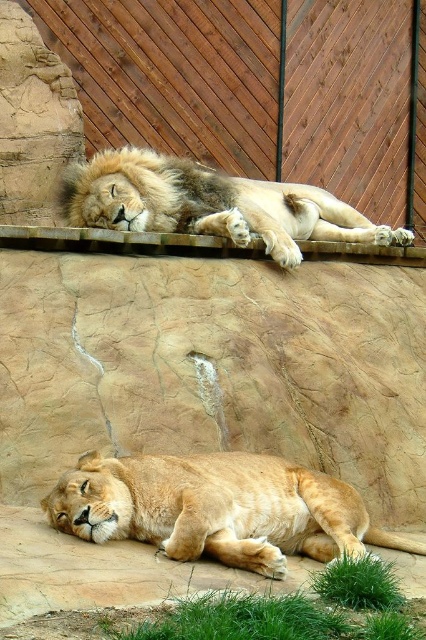
Question: Which object is positioned farthest from the golden fur lion at upper center?

Choices:
 (A) wooden fence at upper center
 (B) golden fur lion at lower center

Answer: (A)

Question: Can you confirm if golden fur lion at lower center is wider than golden fur lion at upper center?

Choices:
 (A) yes
 (B) no

Answer: (B)

Question: Which of the following is the farthest from the observer?

Choices:
 (A) (331, 81)
 (B) (270, 540)

Answer: (A)

Question: In this image, where is wooden fence at upper center located relative to golden fur lion at lower center?

Choices:
 (A) above
 (B) below

Answer: (A)

Question: Which point is farther from the camera taking this photo?

Choices:
 (A) (253, 100)
 (B) (348, 484)
 (C) (193, 227)

Answer: (A)

Question: Is wooden fence at upper center to the left of golden fur lion at lower center from the viewer's perspective?

Choices:
 (A) yes
 (B) no

Answer: (B)